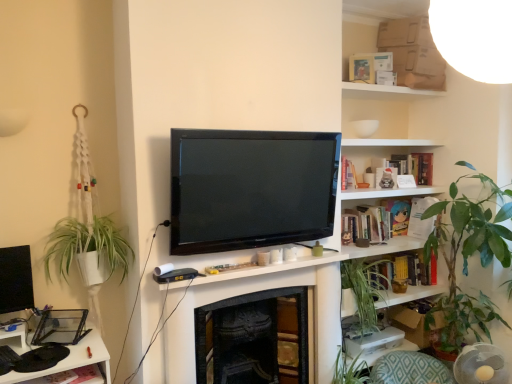
At what (x,y) coordinates should I click in order to perform the action: click on white paper at upper right, which appears as the 2th book when ordered from the bottom. Please return your answer as a coordinate pair (x, y). Looking at the image, I should click on (420, 218).

You are a GUI agent. You are given a task and a screenshot of the screen. Output one action in this format:
    pyautogui.click(x=<x>, y=<y>)
    Task: Click on the white cardboard box at upper right
    
    Given the screenshot: What is the action you would take?
    pyautogui.click(x=474, y=37)

This screenshot has width=512, height=384. I want to click on white paper at upper right, which appears as the second book when viewed from the top, so click(x=420, y=218).

Consider the image. Which is less distant, (455, 17) or (435, 288)?

The point (455, 17) is in front.

Based on their sizes in the image, would you say white cardboard box at upper right is bigger or smaller than wooden bookshelf at upper right?

white cardboard box at upper right is smaller than wooden bookshelf at upper right.

Find the location of a particular element. This screenshot has height=384, width=512. light above the wooden bookshelf at upper right (from a real-world perspective) is located at coordinates click(x=474, y=37).

From a real-world perspective, is white cardboard box at upper right below wooden bookshelf at upper right?

No, from a real-world perspective, white cardboard box at upper right is not below wooden bookshelf at upper right.

Is white paper at upper right, which appears as the second book when viewed from the top, at the left side of wooden bookshelf at upper right?

Incorrect, white paper at upper right, which appears as the second book when viewed from the top, is not on the left side of wooden bookshelf at upper right.

Choose the correct answer: Is white paper at upper right, which appears as the 2th book when ordered from the bottom, inside wooden bookshelf at upper right or outside it?

white paper at upper right, which appears as the 2th book when ordered from the bottom, is not enclosed by wooden bookshelf at upper right.

Is white paper at upper right, which appears as the 2th book when ordered from the bottom, facing away from wooden bookshelf at upper right?

No, wooden bookshelf at upper right is not at the back of white paper at upper right, which appears as the 2th book when ordered from the bottom.

Who is shorter, white cardboard box at upper right or hardcover book at upper right, marked as the 3th book in a bottom-to-top arrangement?

hardcover book at upper right, marked as the 3th book in a bottom-to-top arrangement, is shorter.

Can you confirm if white cardboard box at upper right is smaller than hardcover book at upper right, placed as the first book when sorted from top to bottom?

Actually, white cardboard box at upper right might be larger than hardcover book at upper right, placed as the first book when sorted from top to bottom.

Does point (500, 21) appear closer or farther from the camera than point (406, 170)?

Clearly, point (500, 21) is closer to the camera than point (406, 170).

Does white cardboard box at upper right lie in front of hardcover book at upper right, placed as the first book when sorted from top to bottom?

Yes, white cardboard box at upper right is closer to the viewer.

Is hardcover book at upper right, marked as the 3th book in a bottom-to-top arrangement, looking in the opposite direction of green fabric cushion at lower right?

No, hardcover book at upper right, marked as the 3th book in a bottom-to-top arrangement, is not facing the opposite direction of green fabric cushion at lower right.

Considering the relative sizes of hardcover book at upper right, marked as the 3th book in a bottom-to-top arrangement, and green fabric cushion at lower right in the image provided, is hardcover book at upper right, marked as the 3th book in a bottom-to-top arrangement, shorter than green fabric cushion at lower right?

Correct, hardcover book at upper right, marked as the 3th book in a bottom-to-top arrangement, is not as tall as green fabric cushion at lower right.

From a real-world perspective, is hardcover book at upper right, marked as the 3th book in a bottom-to-top arrangement, on top of green fabric cushion at lower right?

Yes, from a real-world perspective, hardcover book at upper right, marked as the 3th book in a bottom-to-top arrangement, is on top of green fabric cushion at lower right.

Which is in front, point (395, 166) or point (415, 371)?

The point (415, 371) is closer.

From a real-world perspective, is green fabric cushion at lower right on top of white cardboard box at upper right?

No, from a real-world perspective, green fabric cushion at lower right is not on top of white cardboard box at upper right.

Is green fabric cushion at lower right far away from white cardboard box at upper right?

Yes, green fabric cushion at lower right is far from white cardboard box at upper right.

Relative to white cardboard box at upper right, is green fabric cushion at lower right in front or behind?

Visually, green fabric cushion at lower right is located behind white cardboard box at upper right.

Is green fabric cushion at lower right spatially inside white cardboard box at upper right, or outside of it?

green fabric cushion at lower right lies outside white cardboard box at upper right.

How much distance is there between green fabric cushion at lower right and white paper at upper right, which appears as the 2th book when ordered from the bottom?

green fabric cushion at lower right and white paper at upper right, which appears as the 2th book when ordered from the bottom, are 37.06 inches apart from each other.

The height and width of the screenshot is (384, 512). Identify the location of swivel chair in front of the white paper at upper right, which appears as the 2th book when ordered from the bottom. (410, 369).

From the picture: From the image's perspective, which is below, green fabric cushion at lower right or white paper at upper right, which appears as the second book when viewed from the top?

green fabric cushion at lower right.

Is green fabric cushion at lower right facing towards white paper at upper right, which appears as the 2th book when ordered from the bottom?

No.

Which is farther, (x=411, y=213) or (x=403, y=155)?

The point (x=403, y=155) is behind.

Locate an element on the screen. book that appears above the white paper at upper right, which appears as the 2th book when ordered from the bottom (from the image's perspective) is located at coordinates (415, 166).

Is white paper at upper right, which appears as the second book when viewed from the top, at the left side of hardcover book at upper right, marked as the 3th book in a bottom-to-top arrangement?

Incorrect, white paper at upper right, which appears as the second book when viewed from the top, is not on the left side of hardcover book at upper right, marked as the 3th book in a bottom-to-top arrangement.

Which of these two, white paper at upper right, which appears as the second book when viewed from the top, or hardcover book at upper right, marked as the 3th book in a bottom-to-top arrangement, is smaller?

white paper at upper right, which appears as the second book when viewed from the top.

At what (x,y) coordinates should I click in order to perform the action: click on shelf that is behind the white cardboard box at upper right. Please return your answer as a coordinate pair (x, y). Looking at the image, I should click on (411, 294).

Locate an element on the screen. This screenshot has width=512, height=384. the 2nd book counting from the right side of the wooden bookshelf at upper right is located at coordinates (420, 218).

Which object lies nearer to the anchor point white paper at upper right, which appears as the second book when viewed from the top, wooden bookshelf at upper right or green leafy plant at right?

Among the two, green leafy plant at right is located nearer to white paper at upper right, which appears as the second book when viewed from the top.

When comparing their distances from hardcover book at center-right, placed as the first book when sorted from bottom to top, does hardcover book at upper right, marked as the 3th book in a bottom-to-top arrangement, or wooden bookshelf at upper right seem closer?

The object closer to hardcover book at center-right, placed as the first book when sorted from bottom to top, is hardcover book at upper right, marked as the 3th book in a bottom-to-top arrangement.

Based on their spatial positions, is hardcover book at upper right, placed as the first book when sorted from top to bottom, or hardcover book at center-right, placed as the first book when sorted from bottom to top, further from wooden bookshelf at upper right?

The object further to wooden bookshelf at upper right is hardcover book at upper right, placed as the first book when sorted from top to bottom.

Based on their spatial positions, is green fabric cushion at lower right or wooden bookshelf at upper right further from green leafy plant at right?

The object further to green leafy plant at right is green fabric cushion at lower right.

Based on their spatial positions, is hardcover book at center-right, marked as the third book in a top-to-bottom arrangement, or hardcover book at upper right, marked as the 3th book in a bottom-to-top arrangement, closer to white cardboard box at upper right?

hardcover book at center-right, marked as the third book in a top-to-bottom arrangement, lies closer to white cardboard box at upper right than the other object.

Estimate the real-world distances between objects in this image. Which object is further from hardcover book at upper right, placed as the first book when sorted from top to bottom, hardcover book at center-right, marked as the third book in a top-to-bottom arrangement, or wooden bookshelf at upper right?

Based on the image, wooden bookshelf at upper right appears to be further to hardcover book at upper right, placed as the first book when sorted from top to bottom.

Based on the photo, which object lies nearer to the anchor point white cardboard box at upper right, white paper at upper right, which appears as the 2th book when ordered from the bottom, or hardcover book at upper right, marked as the 3th book in a bottom-to-top arrangement?

white paper at upper right, which appears as the 2th book when ordered from the bottom.

From the image, which object appears to be nearer to wooden bookshelf at upper right, hardcover book at upper right, placed as the first book when sorted from top to bottom, or green leafy plant at right?

green leafy plant at right is closer to wooden bookshelf at upper right.

Locate an element on the screen. The image size is (512, 384). book between white cardboard box at upper right and hardcover book at upper right, marked as the 3th book in a bottom-to-top arrangement, from front to back is located at coordinates (411, 216).

The width and height of the screenshot is (512, 384). I want to click on shelf that lies between hardcover book at center-right, marked as the third book in a top-to-bottom arrangement, and green fabric cushion at lower right from top to bottom, so click(411, 294).

The image size is (512, 384). I want to click on swivel chair between white cardboard box at upper right and white paper at upper right, which appears as the 2th book when ordered from the bottom, along the z-axis, so click(x=410, y=369).

Image resolution: width=512 pixels, height=384 pixels. I want to click on swivel chair between green leafy plant at right and white paper at upper right, which appears as the second book when viewed from the top, in the front-back direction, so pos(410,369).